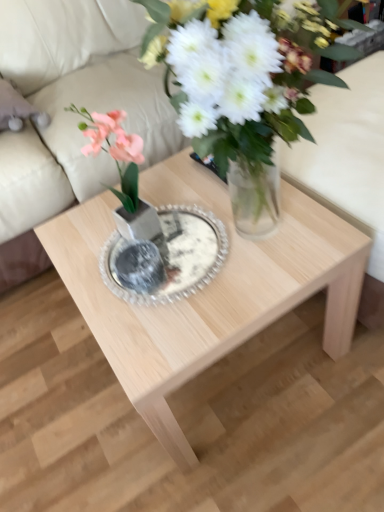
Where is `vacant area that lies in front of natural wood coffee table at center`? vacant area that lies in front of natural wood coffee table at center is located at coordinates (268, 456).